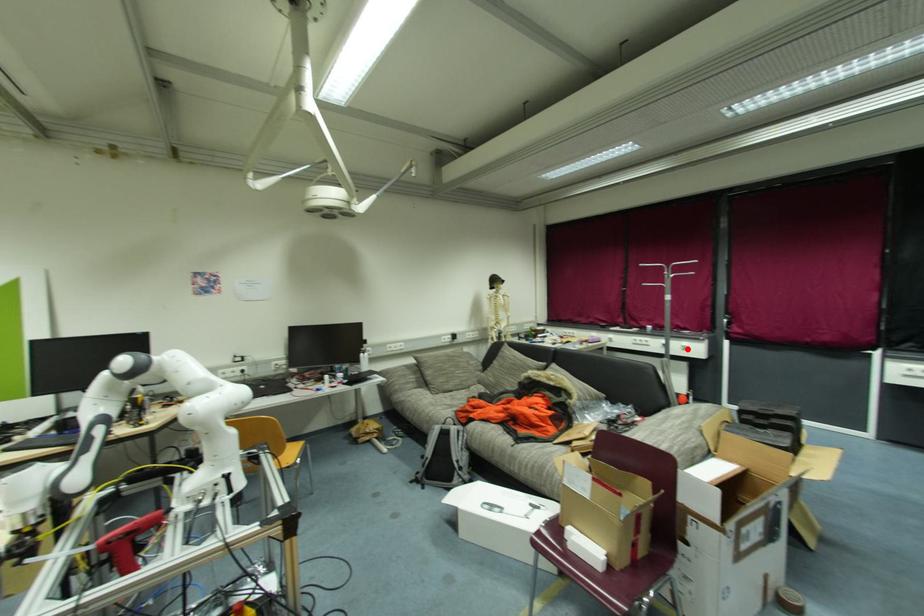
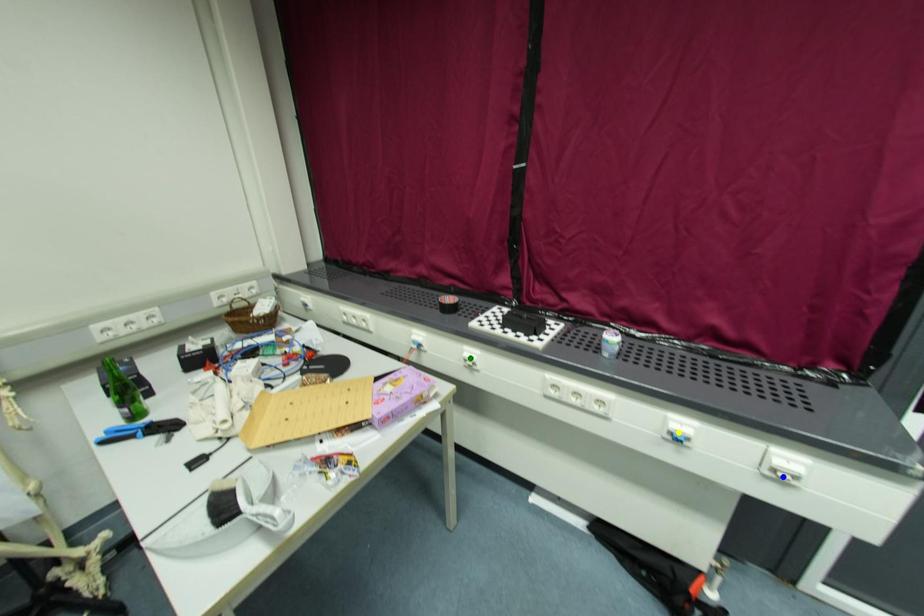
Question: I am providing you with two images of the same scene from different viewpoints. A red point is marked on the first image. You are given multiple points on the second image. Which point in image 2 is actually the same real-world point as the red point in image 1?

Choices:
 (A) yellow point
 (B) blue point
 (C) green point

Answer: (B)